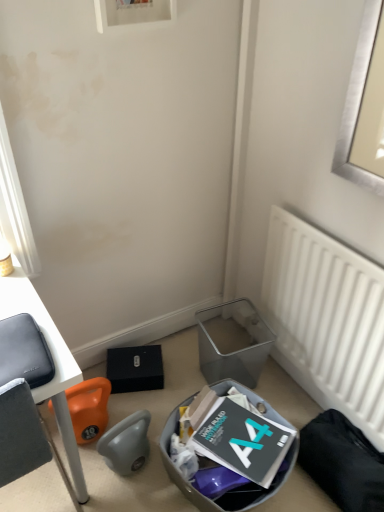
Question: Is white matte radiator at right not inside metallic gray trash bin at lower center, which ranks as the 1th trash bin/can in front-to-back order?

Choices:
 (A) yes
 (B) no

Answer: (A)

Question: Considering the relative sizes of white matte radiator at right and metallic gray trash bin at lower center, which is the 2th trash bin/can in back-to-front order, in the image provided, is white matte radiator at right taller than metallic gray trash bin at lower center, which is the 2th trash bin/can in back-to-front order,?

Choices:
 (A) yes
 (B) no

Answer: (A)

Question: Does white matte radiator at right lie in front of metallic gray trash bin at lower center, which ranks as the 1th trash bin/can in front-to-back order?

Choices:
 (A) yes
 (B) no

Answer: (A)

Question: Does white matte radiator at right appear on the left side of metallic gray trash bin at lower center, which is the 2th trash bin/can in back-to-front order?

Choices:
 (A) yes
 (B) no

Answer: (B)

Question: Does white matte radiator at right have a lesser width compared to metallic gray trash bin at lower center, which ranks as the 1th trash bin/can in front-to-back order?

Choices:
 (A) yes
 (B) no

Answer: (A)

Question: Is metallic gray trash bin/can at lower center, the 2th trash bin/can viewed from the front, to the left or to the right of matte black laptop at left in the image?

Choices:
 (A) right
 (B) left

Answer: (A)

Question: Considering the positions of metallic gray trash bin/can at lower center, the 2th trash bin/can viewed from the front, and matte black laptop at left in the image, is metallic gray trash bin/can at lower center, the 2th trash bin/can viewed from the front, bigger or smaller than matte black laptop at left?

Choices:
 (A) big
 (B) small

Answer: (B)

Question: From the image's perspective, is metallic gray trash bin/can at lower center, the 1th trash bin/can viewed from the back, located above or below matte black laptop at left?

Choices:
 (A) above
 (B) below

Answer: (A)

Question: From a real-world perspective, is metallic gray trash bin/can at lower center, the 2th trash bin/can viewed from the front, physically located above or below matte black laptop at left?

Choices:
 (A) below
 (B) above

Answer: (A)

Question: Based on their positions, is metallic gray trash bin at lower center, which is the 2th trash bin/can in back-to-front order, located to the left or right of matte black laptop at left?

Choices:
 (A) left
 (B) right

Answer: (B)

Question: In terms of size, does metallic gray trash bin at lower center, which is the 2th trash bin/can in back-to-front order, appear bigger or smaller than matte black laptop at left?

Choices:
 (A) big
 (B) small

Answer: (B)

Question: From the image's perspective, relative to matte black laptop at left, is metallic gray trash bin at lower center, which is the 2th trash bin/can in back-to-front order, above or below?

Choices:
 (A) above
 (B) below

Answer: (B)

Question: Is metallic gray trash bin at lower center, which ranks as the 1th trash bin/can in front-to-back order, inside or outside of matte black laptop at left?

Choices:
 (A) outside
 (B) inside

Answer: (A)

Question: From a real-world perspective, is matte black laptop at left above or below metallic gray trash bin/can at lower center, the 1th trash bin/can viewed from the back?

Choices:
 (A) below
 (B) above

Answer: (B)

Question: Is matte black laptop at left in front of or behind metallic gray trash bin/can at lower center, the 1th trash bin/can viewed from the back, in the image?

Choices:
 (A) behind
 (B) front

Answer: (B)